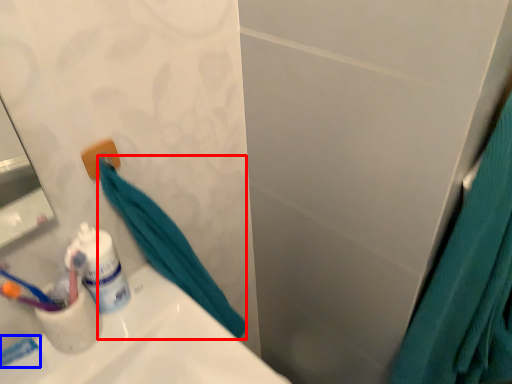
Question: Which of the following is the farthest to the observer, bath towel (highlighted by a red box) or toothpaste (highlighted by a blue box)?

Choices:
 (A) bath towel
 (B) toothpaste

Answer: (B)